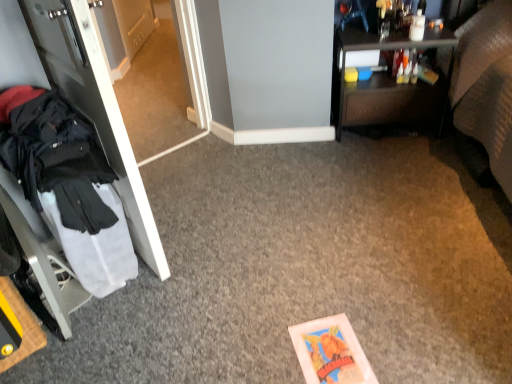
The image size is (512, 384). Identify the location of vacant space behind white glossy door at left. (181, 172).